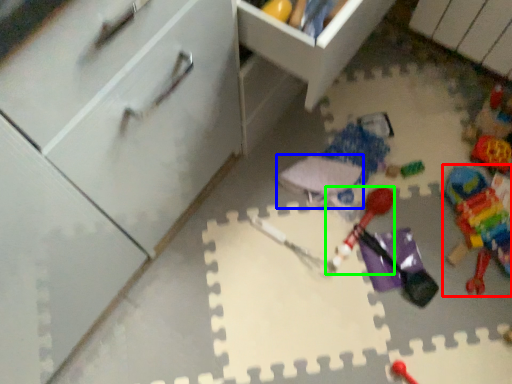
Question: Based on their relative distances, which object is nearer to toy (highlighted by a red box)? Choose from toy (highlighted by a blue box) and toy (highlighted by a green box).

Choices:
 (A) toy
 (B) toy

Answer: (B)